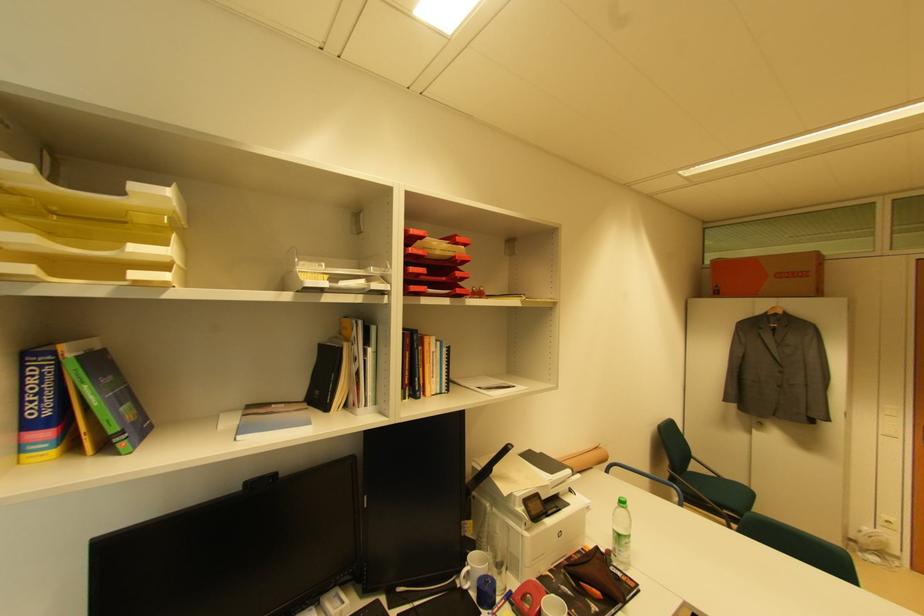
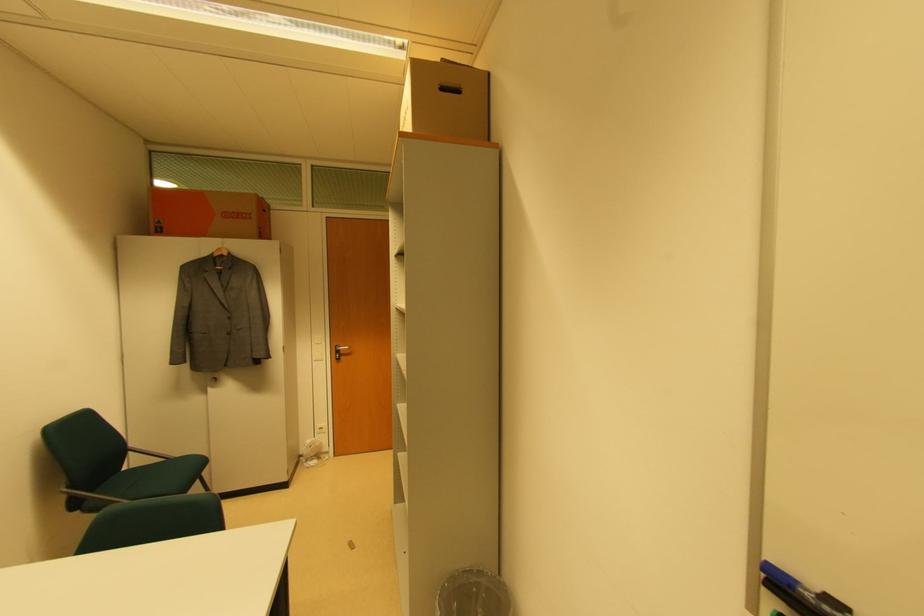
Find the pixel in the second image that matches the point at 761,427 in the first image.

(216, 382)